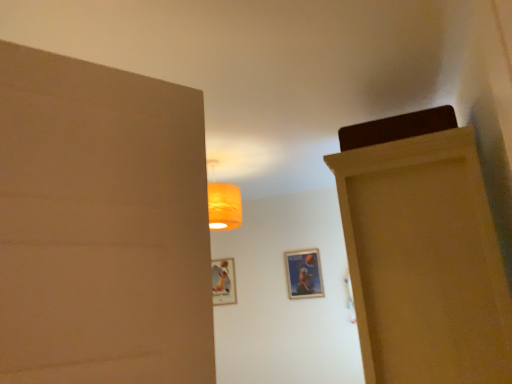
Question: From the image's perspective, is wooden door at right under matte plastic picture frame at center, which is the 1th picture frame from left to right?

Choices:
 (A) no
 (B) yes

Answer: (A)

Question: Is wooden door at right to the right of matte plastic picture frame at center, the second picture frame positioned from the right, from the viewer's perspective?

Choices:
 (A) no
 (B) yes

Answer: (B)

Question: Does wooden door at right lie behind matte plastic picture frame at center, arranged as the 1th picture frame when viewed from the back?

Choices:
 (A) no
 (B) yes

Answer: (A)

Question: Is wooden door at right shorter than matte plastic picture frame at center, arranged as the 1th picture frame when viewed from the back?

Choices:
 (A) no
 (B) yes

Answer: (A)

Question: Is the surface of wooden door at right in direct contact with matte plastic picture frame at center, the second picture frame positioned from the right?

Choices:
 (A) no
 (B) yes

Answer: (A)

Question: From the image's perspective, is matte plastic picture frame at center, which is the second picture frame in front-to-back order, above or below metallic silver picture frame at center, which ranks as the first picture frame in front-to-back order?

Choices:
 (A) above
 (B) below

Answer: (B)

Question: Considering the positions of matte plastic picture frame at center, which is the second picture frame in front-to-back order, and metallic silver picture frame at center, which ranks as the first picture frame in front-to-back order, in the image, is matte plastic picture frame at center, which is the second picture frame in front-to-back order, wider or thinner than metallic silver picture frame at center, which ranks as the first picture frame in front-to-back order,?

Choices:
 (A) thin
 (B) wide

Answer: (B)

Question: Visually, is matte plastic picture frame at center, the second picture frame positioned from the right, positioned to the left or to the right of metallic silver picture frame at center, which is the second picture frame in back-to-front order?

Choices:
 (A) left
 (B) right

Answer: (A)

Question: Looking at the image, does matte plastic picture frame at center, the second picture frame positioned from the right, seem bigger or smaller compared to metallic silver picture frame at center, which is the second picture frame in back-to-front order?

Choices:
 (A) small
 (B) big

Answer: (B)

Question: Relative to matte plastic picture frame at center, which is the 1th picture frame from left to right, is metallic silver picture frame at center, which is the second picture frame in back-to-front order, in front or behind?

Choices:
 (A) front
 (B) behind

Answer: (A)

Question: Is metallic silver picture frame at center, which is the second picture frame in back-to-front order, inside the boundaries of matte plastic picture frame at center, arranged as the 1th picture frame when viewed from the back, or outside?

Choices:
 (A) outside
 (B) inside

Answer: (A)

Question: Would you say metallic silver picture frame at center, which ranks as the first picture frame in front-to-back order, is to the left or to the right of matte plastic picture frame at center, which is the second picture frame in front-to-back order, in the picture?

Choices:
 (A) left
 (B) right

Answer: (B)

Question: From the image's perspective, is metallic silver picture frame at center, arranged as the first picture frame when viewed from the right, located above or below matte plastic picture frame at center, which is the 1th picture frame from left to right?

Choices:
 (A) below
 (B) above

Answer: (B)

Question: From a real-world perspective, is wooden door at right physically located above or below matte plastic picture frame at center, arranged as the 1th picture frame when viewed from the back?

Choices:
 (A) above
 (B) below

Answer: (B)

Question: Is point (458, 324) positioned closer to the camera than point (221, 296)?

Choices:
 (A) closer
 (B) farther

Answer: (A)